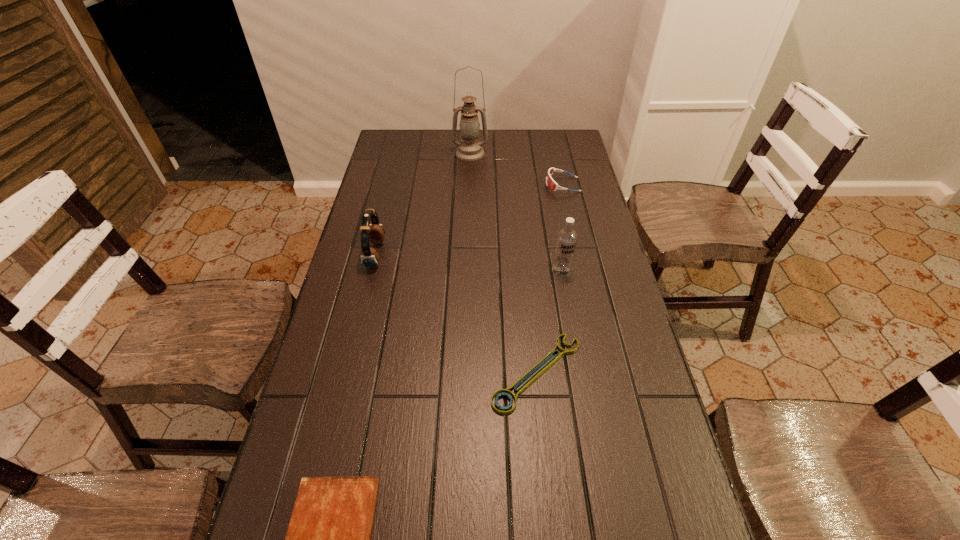
Where is `vacant area situated on the ear cup of the headset`? The height and width of the screenshot is (540, 960). vacant area situated on the ear cup of the headset is located at coordinates (406, 255).

Identify the location of vacant position located 0.210m on the front-facing side of the goggles. (490, 185).

Identify the location of vacant area situated on the front-facing side of the goggles. (516, 185).

Locate an element on the screen. The width and height of the screenshot is (960, 540). vacant space located on the front-facing side of the goggles is located at coordinates (532, 185).

Image resolution: width=960 pixels, height=540 pixels. In order to click on free spot located 0.330m on the back of the shortest object in this screenshot , I will do `click(524, 252)`.

Where is `object that is at the far edge`? The height and width of the screenshot is (540, 960). object that is at the far edge is located at coordinates 469,149.

Locate an element on the screen. This screenshot has width=960, height=540. object that is at the left edge is located at coordinates (374, 232).

Find the location of a particular element. The width and height of the screenshot is (960, 540). vodka at the right edge is located at coordinates (566, 240).

The height and width of the screenshot is (540, 960). I want to click on goggles that is at the right edge, so click(551, 184).

In order to click on wrench present at the right edge in this screenshot , I will do (507, 393).